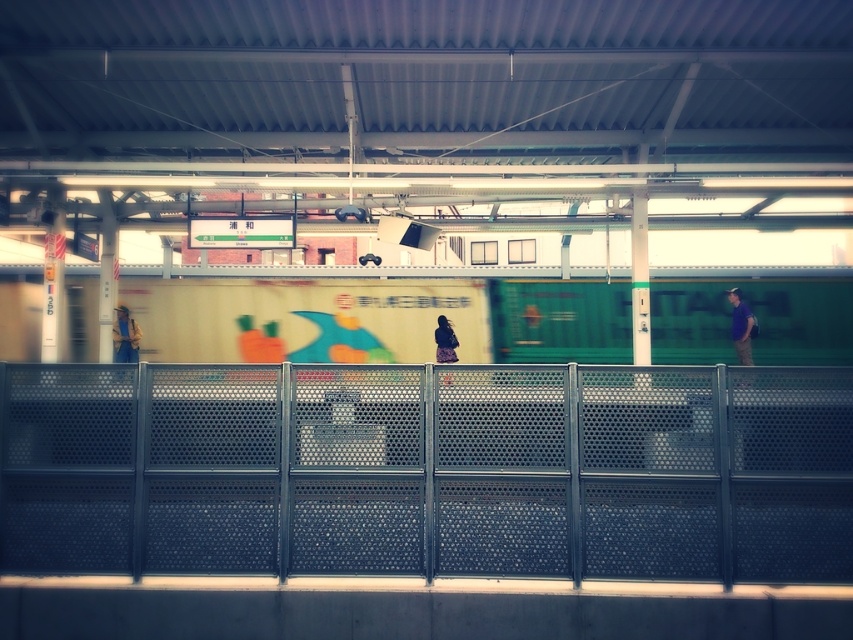
Question: Which point is closer to the camera?

Choices:
 (A) metallic perforated fence at center
 (B) purple fabric shirt at right
 (C) denim jacket at left
 (D) dark purple fabric at center

Answer: (A)

Question: Can you confirm if purple fabric shirt at right is wider than denim jacket at left?

Choices:
 (A) yes
 (B) no

Answer: (A)

Question: In this image, where is purple fabric shirt at right located relative to denim jacket at left?

Choices:
 (A) above
 (B) below

Answer: (A)

Question: Estimate the real-world distances between objects in this image. Which object is farther from the purple fabric shirt at right?

Choices:
 (A) denim jacket at left
 (B) green matte train at center

Answer: (A)

Question: Which object appears farthest from the camera in this image?

Choices:
 (A) dark purple fabric at center
 (B) metallic perforated fence at center
 (C) denim jacket at left

Answer: (C)

Question: Is metallic perforated fence at center positioned before green matte train at center?

Choices:
 (A) yes
 (B) no

Answer: (A)